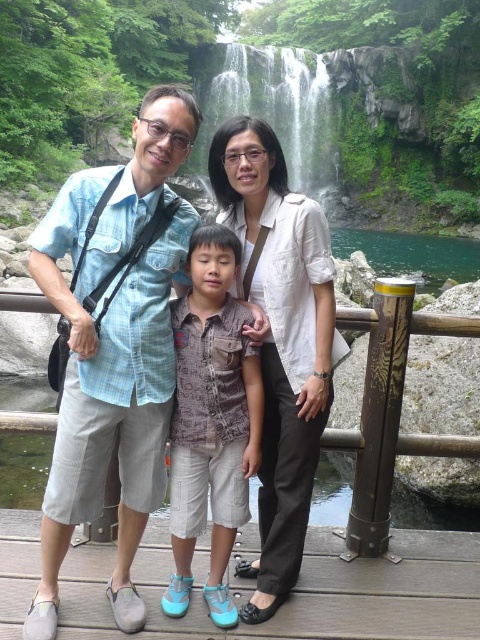
What do you see at coordinates (113, 349) in the screenshot? I see `light blue denim shirt at center` at bounding box center [113, 349].

Between light blue denim shirt at center and green mossy rock at upper center, which one has more height?

Standing taller between the two is green mossy rock at upper center.

Is point (52, 250) more distant than point (225, 61)?

No, it is not.

Find the location of a particular element. light blue denim shirt at center is located at coordinates (113, 349).

Is light blue denim shirt at center to the right of brown printed shirt at center from the viewer's perspective?

Incorrect, light blue denim shirt at center is not on the right side of brown printed shirt at center.

Who is taller, light blue denim shirt at center or brown printed shirt at center?

light blue denim shirt at center is taller.

Does point (144, 257) lie in front of point (259, 365)?

Yes, point (144, 257) is in front of point (259, 365).

You are a GUI agent. You are given a task and a screenshot of the screen. Output one action in this format:
    pyautogui.click(x=<x>, y=<y>)
    Task: Click on the light blue denim shirt at center
    The height and width of the screenshot is (640, 480).
    Given the screenshot: What is the action you would take?
    pyautogui.click(x=113, y=349)

Who is lower down, white cotton blouse at center or green mossy rock at upper center?

white cotton blouse at center is lower down.

Can you confirm if white cotton blouse at center is shorter than green mossy rock at upper center?

Correct, white cotton blouse at center is not as tall as green mossy rock at upper center.

Measure the distance between white cotton blouse at center and camera.

white cotton blouse at center is 10.50 meters from camera.

Locate an element on the screen. white cotton blouse at center is located at coordinates (279, 339).